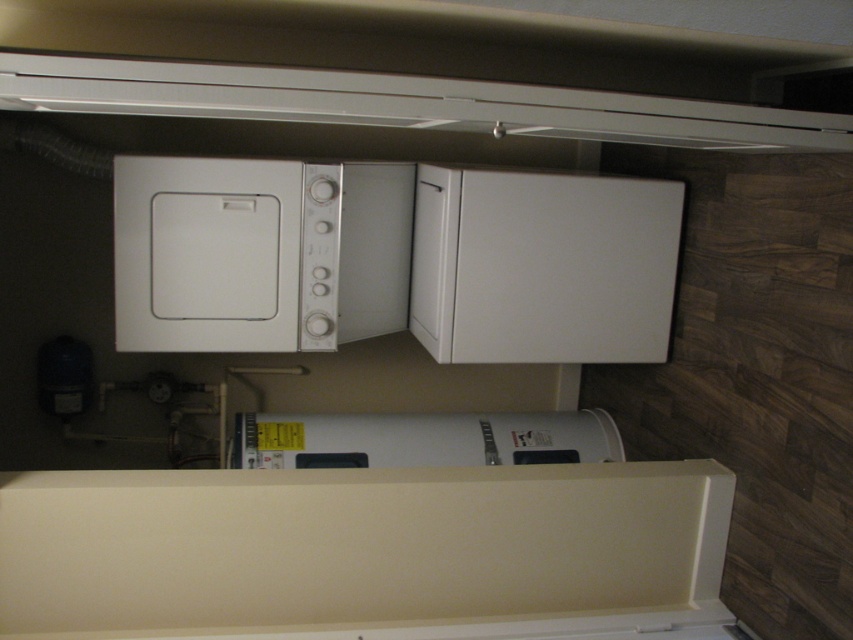
Does point (332, 232) come behind point (286, 90)?

Yes.

Does white matte microwave at upper left have a larger size compared to white matte exhaust hood at upper center?

Yes.

What do you see at coordinates (259, 253) in the screenshot?
I see `white matte microwave at upper left` at bounding box center [259, 253].

The height and width of the screenshot is (640, 853). I want to click on white matte microwave at upper left, so click(259, 253).

Can you confirm if white matte exhaust hood at upper center is positioned to the right of white matte water heater at center?

Indeed, white matte exhaust hood at upper center is positioned on the right side of white matte water heater at center.

Image resolution: width=853 pixels, height=640 pixels. I want to click on white matte exhaust hood at upper center, so click(x=403, y=104).

This screenshot has width=853, height=640. I want to click on white matte exhaust hood at upper center, so click(403, 104).

Can you confirm if white matte microwave at upper left is positioned below white matte water heater at center?

Actually, white matte microwave at upper left is above white matte water heater at center.

Which is in front, point (198, 305) or point (473, 422)?

Point (198, 305) is in front.

Measure the distance between point (360, 214) and camera.

Point (360, 214) and camera are 2.01 meters apart from each other.

The width and height of the screenshot is (853, 640). What are the coordinates of `white matte microwave at upper left` in the screenshot? It's located at (259, 253).